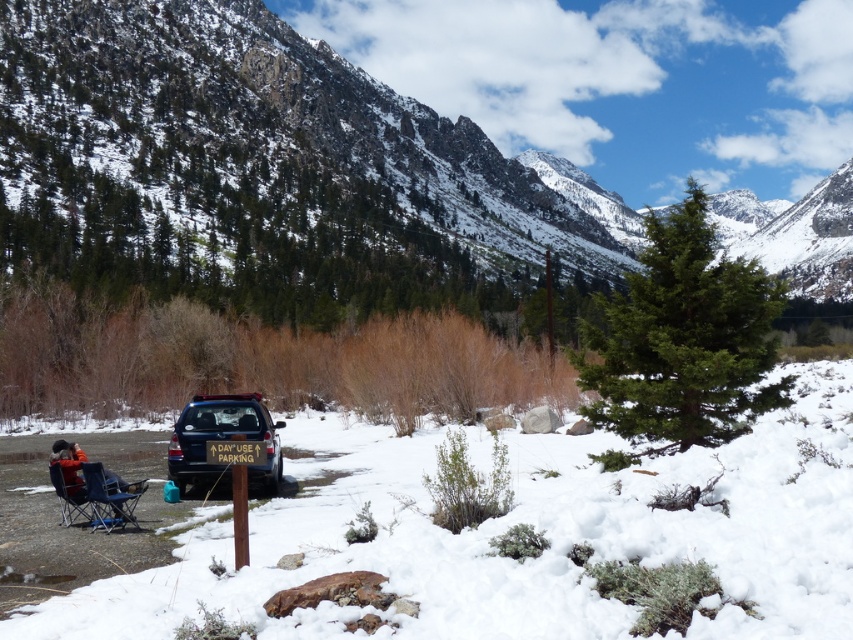
Question: Does snowy rocky mountain at upper center appear on the left side of matte blue folding chair at lower left?

Choices:
 (A) yes
 (B) no

Answer: (B)

Question: Which object is positioned closest to the matte blue folding chair at lower left?

Choices:
 (A) blue fabric chair at lower left
 (B) snowy rocky mountain at upper center
 (C) matte black suv at center
 (D) orange fleece jacket at lower left

Answer: (D)

Question: Which object appears closest to the camera in this image?

Choices:
 (A) snowy rocky mountain at upper center
 (B) white fluffy snow at lower center
 (C) orange fleece jacket at lower left
 (D) matte blue folding chair at lower left

Answer: (B)

Question: Which is farther from the matte blue folding chair at lower left?

Choices:
 (A) matte black suv at center
 (B) blue fabric chair at lower left

Answer: (A)

Question: Is white fluffy snow at lower center above matte black suv at center?

Choices:
 (A) yes
 (B) no

Answer: (B)

Question: Can you confirm if orange fleece jacket at lower left is wider than blue fabric chair at lower left?

Choices:
 (A) yes
 (B) no

Answer: (A)